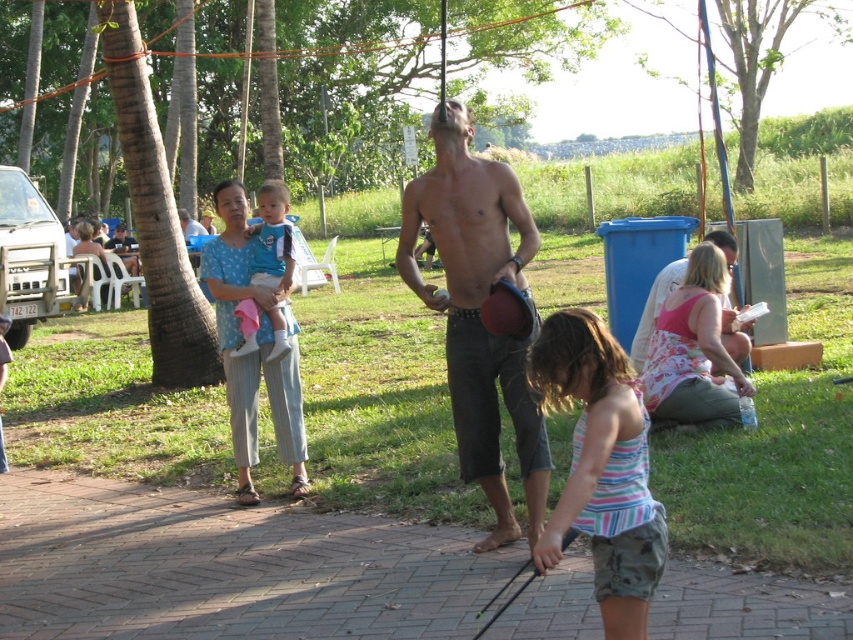
Question: Which is farther from the shiny brown belt at center?

Choices:
 (A) striped fabric dress at lower center
 (B) blue polka dot dress at center
 (C) shiny metallic helmet at center
 (D) blue cotton shirt at center

Answer: (B)

Question: Can you confirm if shiny brown belt at center is smaller than striped fabric dress at lower center?

Choices:
 (A) no
 (B) yes

Answer: (A)

Question: Which point appears farthest from the camera in this image?

Choices:
 (A) (86, 236)
 (B) (535, 438)
 (C) (282, 182)
 (D) (640, 328)

Answer: (A)

Question: Can you confirm if striped fabric dress at lower center is wider than blue cotton shirt at center?

Choices:
 (A) no
 (B) yes

Answer: (B)

Question: Estimate the real-world distances between objects in this image. Which object is farther from the blue cotton shirt at center?

Choices:
 (A) shiny brown belt at center
 (B) shiny metallic helmet at center
 (C) striped fabric dress at lower center
 (D) blue polka dot dress at center

Answer: (D)

Question: Can you confirm if shiny brown belt at center is smaller than blue polka dot dress at center?

Choices:
 (A) no
 (B) yes

Answer: (B)